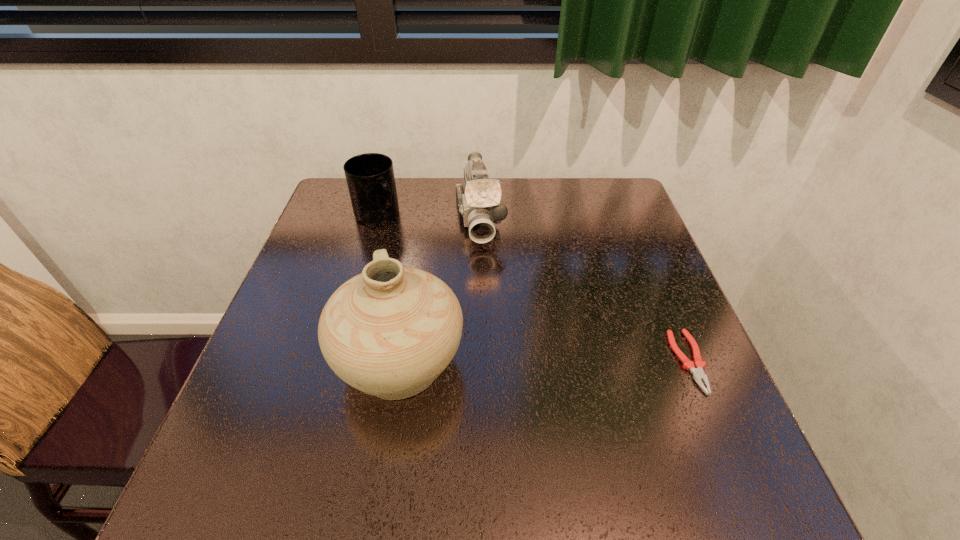
Find the location of a particular element. vacant area that lies between the tallest object and the shortest object is located at coordinates (544, 362).

Where is `blank region between the second tallest object and the mug`? The height and width of the screenshot is (540, 960). blank region between the second tallest object and the mug is located at coordinates (428, 217).

Image resolution: width=960 pixels, height=540 pixels. In order to click on empty location between the shortest object and the mug in this screenshot , I will do `click(533, 288)`.

The width and height of the screenshot is (960, 540). What are the coordinates of `free space between the shortest object and the pottery` in the screenshot? It's located at (544, 362).

Locate an element on the screen. Image resolution: width=960 pixels, height=540 pixels. vacant area that lies between the pliers and the camcorder is located at coordinates (585, 290).

Image resolution: width=960 pixels, height=540 pixels. I want to click on free area in between the pottery and the pliers, so click(x=544, y=362).

The width and height of the screenshot is (960, 540). Identify the location of object identified as the closest to the shortest object. (479, 208).

Identify which object is located as the third nearest to the mug. Please provide its 2D coordinates. Your answer should be formatted as a tuple, i.e. [(x, y)], where the tuple contains the x and y coordinates of a point satisfying the conditions above.

[(698, 373)]